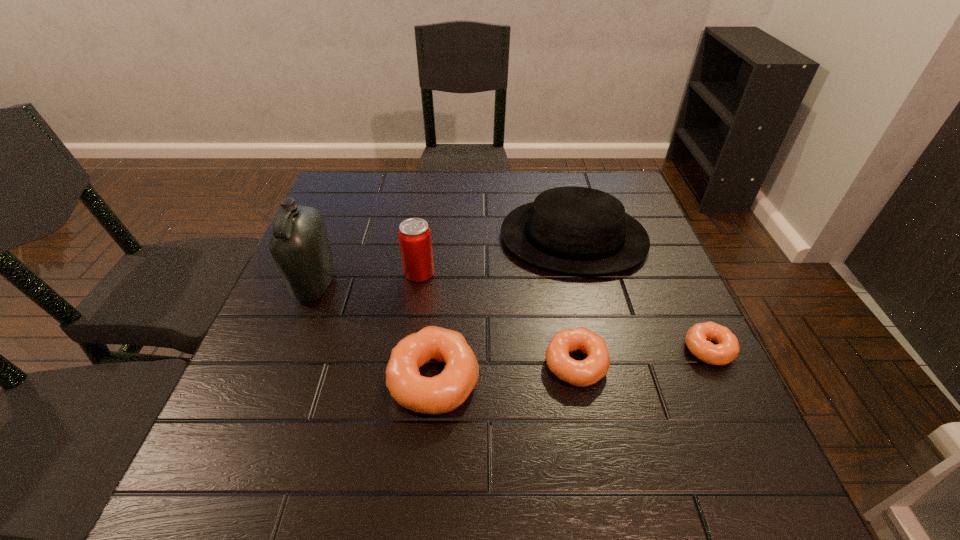
Locate an element on the screen. the fourth tallest object is located at coordinates (443, 393).

The image size is (960, 540). Identify the location of the tallest doughnut. tap(443, 393).

Where is `the second doughnut from left to right`? This screenshot has width=960, height=540. the second doughnut from left to right is located at coordinates (589, 371).

This screenshot has width=960, height=540. Identify the location of the second shortest object. (589, 371).

Identify the location of the rightmost doughnut. This screenshot has width=960, height=540. (727, 348).

You are a GUI agent. You are given a task and a screenshot of the screen. Output one action in this format:
    pyautogui.click(x=<x>, y=<y>)
    Task: Click on the shortest object
    This screenshot has height=540, width=960.
    Given the screenshot: What is the action you would take?
    pyautogui.click(x=727, y=348)

Find the location of `bottle`. bottle is located at coordinates (300, 246).

Where is `the tallest object`? This screenshot has width=960, height=540. the tallest object is located at coordinates (300, 246).

Identify the location of can. Image resolution: width=960 pixels, height=540 pixels. (414, 234).

I want to click on the third tallest object, so click(578, 230).